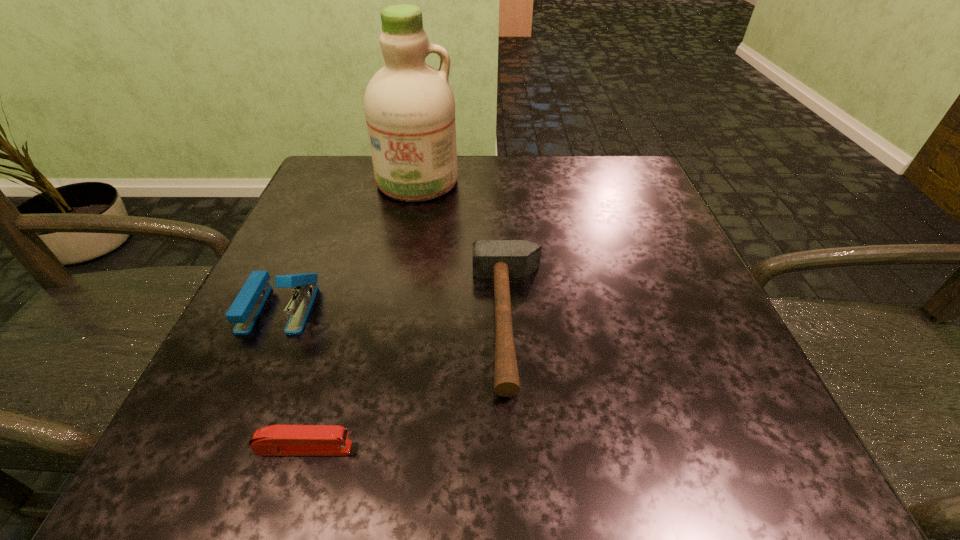
This screenshot has width=960, height=540. I want to click on free spot between the tallest object and the nearest object, so click(361, 315).

Locate an element on the screen. blank region between the shorter stapler and the third tallest object is located at coordinates pos(407,384).

At what (x,y) coordinates should I click in order to perform the action: click on vacant space in between the shorter stapler and the cleansing agent. Please return your answer as a coordinate pair (x, y). Looking at the image, I should click on (361, 315).

Where is `free space between the farthest object and the second shortest object`? This screenshot has width=960, height=540. free space between the farthest object and the second shortest object is located at coordinates (464, 251).

In order to click on vacant space that is in between the tallest object and the taller stapler in this screenshot , I will do `click(348, 245)`.

Where is `free space between the hammer and the nearest object`? free space between the hammer and the nearest object is located at coordinates (407, 384).

Locate an element on the screen. The image size is (960, 540). object that is the third closest one to the hammer is located at coordinates (244, 311).

Locate which object is the third closest to the farthest object. Please provide its 2D coordinates. Your answer should be formatted as a tuple, i.e. [(x, y)], where the tuple contains the x and y coordinates of a point satisfying the conditions above.

[(277, 440)]

Where is `vacant area in the image that satisfies the following two spatial constraints: 1. on the front label of the cleansing agent; 2. on the front-facing side of the nearest object`? The height and width of the screenshot is (540, 960). vacant area in the image that satisfies the following two spatial constraints: 1. on the front label of the cleansing agent; 2. on the front-facing side of the nearest object is located at coordinates (365, 448).

Where is `free location that satisfies the following two spatial constraints: 1. on the front label of the cleansing agent; 2. on the front-facing side of the shorter stapler`? Image resolution: width=960 pixels, height=540 pixels. free location that satisfies the following two spatial constraints: 1. on the front label of the cleansing agent; 2. on the front-facing side of the shorter stapler is located at coordinates (365, 448).